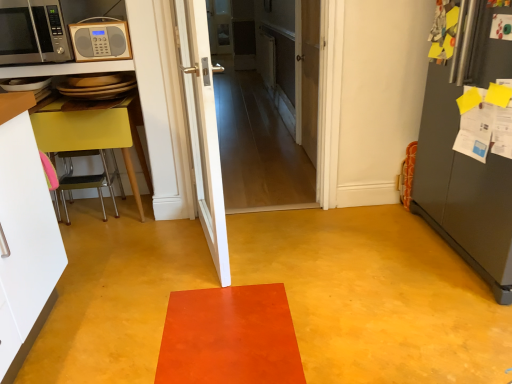
Where is `free region under white glossy door at center, which appears as the first door when viewed from the front (from a real-world perspective)`? The height and width of the screenshot is (384, 512). free region under white glossy door at center, which appears as the first door when viewed from the front (from a real-world perspective) is located at coordinates (208, 247).